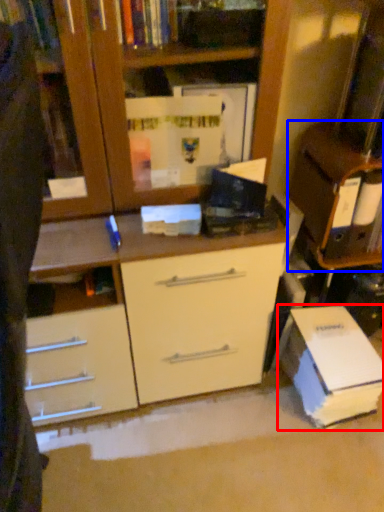
Question: Which point is closer to the camera, paperback book (highlighted by a red box) or cabinetry (highlighted by a blue box)?

Choices:
 (A) paperback book
 (B) cabinetry

Answer: (B)